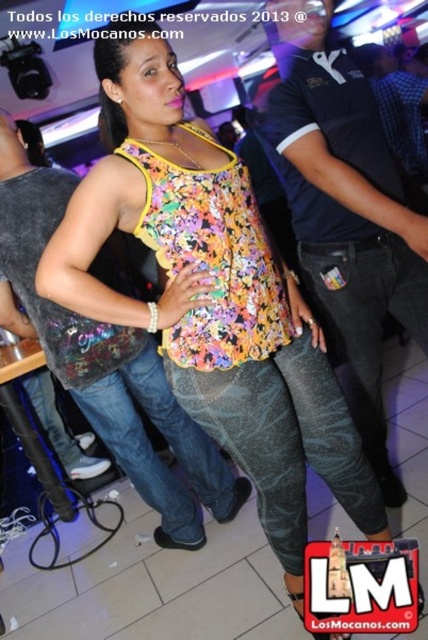
You are at a party and need to find your friend who is wearing a black cotton polo shirt at center and denim jeans at center. Based on the scene description, which item of clothing is positioned to the right of the other?

The black cotton polo shirt at center is to the right of denim jeans at center.